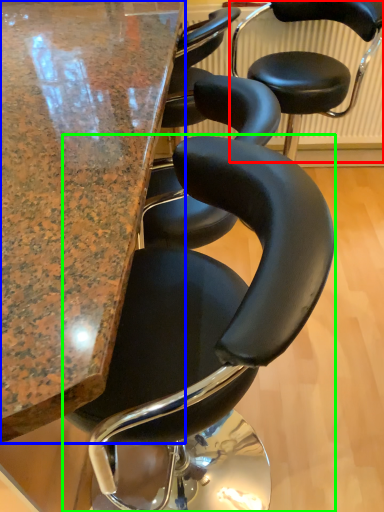
Question: Which object is positioned closest to chair (highlighted by a red box)? Select from table (highlighted by a blue box) and chair (highlighted by a green box).

Choices:
 (A) table
 (B) chair

Answer: (A)